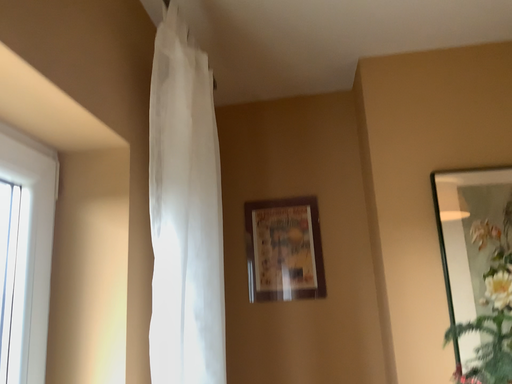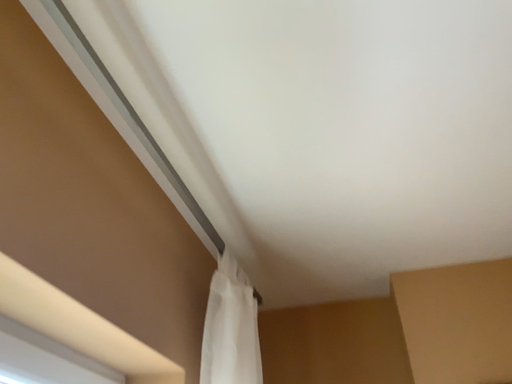
Question: How did the camera likely rotate when shooting the video?

Choices:
 (A) rotated left
 (B) rotated right

Answer: (A)